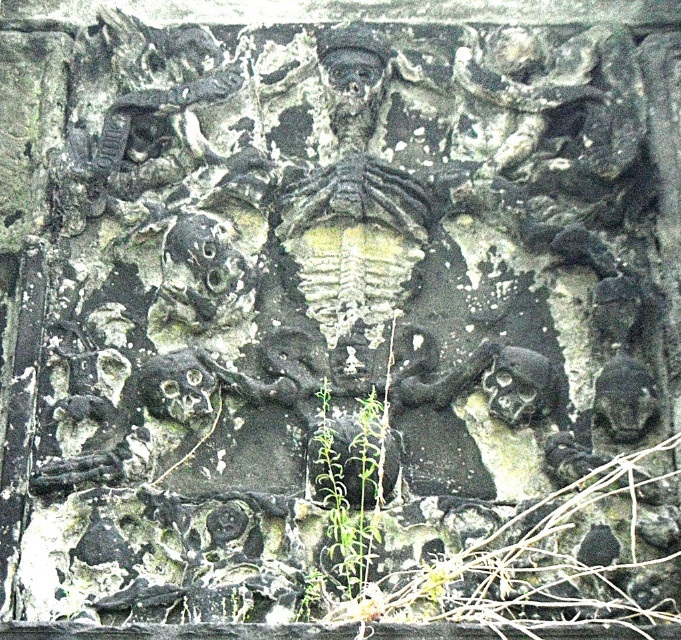
You are an archaeologist examining the stone relief. You notice the green leafy plant at center and the dark gray stone skull at lower right. Which object appears narrower in the image?

The green leafy plant at center appears narrower than the dark gray stone skull at lower right because its width is less than the skull.

You are an archaeologist examining the ancient stone relief. You notice a green leafy plant growing on it. Where exactly is the green leafy plant at center located on the relief?

The green leafy plant at center is located at point coordinates of (349, 493) on the relief.